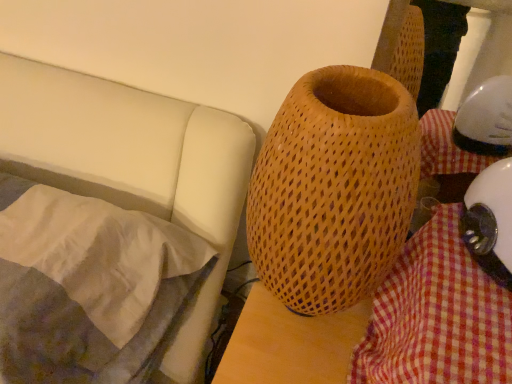
Question: Is silky white pillow at left positioned in front of checkered fabric at lower right?

Choices:
 (A) no
 (B) yes

Answer: (A)

Question: Does silky white pillow at left have a lesser height compared to checkered fabric at lower right?

Choices:
 (A) no
 (B) yes

Answer: (B)

Question: Would you consider silky white pillow at left to be distant from checkered fabric at lower right?

Choices:
 (A) yes
 (B) no

Answer: (B)

Question: From the image's perspective, is silky white pillow at left beneath checkered fabric at lower right?

Choices:
 (A) no
 (B) yes

Answer: (A)

Question: From a real-world perspective, is silky white pillow at left under checkered fabric at lower right?

Choices:
 (A) yes
 (B) no

Answer: (A)

Question: Is wooden textured vase at center to the left or to the right of white glossy helmet at lower right in the image?

Choices:
 (A) right
 (B) left

Answer: (B)

Question: Considering the positions of wooden textured vase at center and white glossy helmet at lower right in the image, is wooden textured vase at center taller or shorter than white glossy helmet at lower right?

Choices:
 (A) tall
 (B) short

Answer: (A)

Question: In terms of size, does wooden textured vase at center appear bigger or smaller than white glossy helmet at lower right?

Choices:
 (A) big
 (B) small

Answer: (A)

Question: Is wooden textured vase at center in front of or behind white glossy helmet at lower right in the image?

Choices:
 (A) front
 (B) behind

Answer: (A)

Question: Considering the relative positions of wooden textured vase at center and checkered fabric at lower right in the image provided, is wooden textured vase at center to the left or to the right of checkered fabric at lower right?

Choices:
 (A) left
 (B) right

Answer: (A)

Question: From the image's perspective, is wooden textured vase at center positioned above or below checkered fabric at lower right?

Choices:
 (A) above
 (B) below

Answer: (A)

Question: In the image, is wooden textured vase at center positioned in front of or behind checkered fabric at lower right?

Choices:
 (A) behind
 (B) front

Answer: (B)

Question: Is wooden textured vase at center bigger or smaller than checkered fabric at lower right?

Choices:
 (A) big
 (B) small

Answer: (A)

Question: Is white glossy helmet at lower right taller or shorter than wooden textured vase at center?

Choices:
 (A) short
 (B) tall

Answer: (A)

Question: Would you say white glossy helmet at lower right is inside or outside wooden textured vase at center?

Choices:
 (A) outside
 (B) inside

Answer: (A)